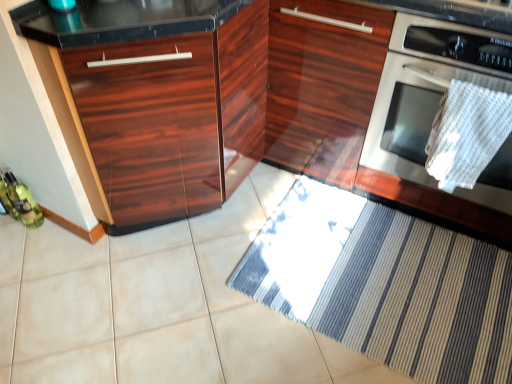
The height and width of the screenshot is (384, 512). I want to click on vacant area that is situated to the right of green glass bottle at lower left, so coord(59,236).